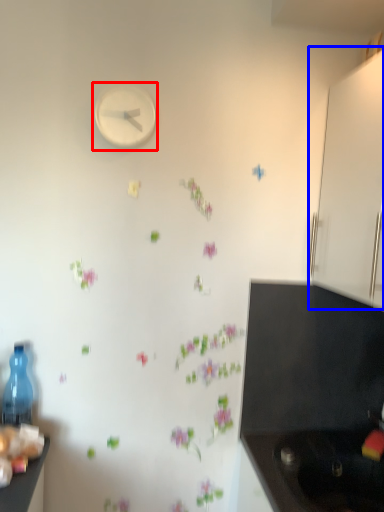
Question: Which point is closer to the camera, clock (highlighted by a red box) or cabinetry (highlighted by a blue box)?

Choices:
 (A) clock
 (B) cabinetry

Answer: (B)